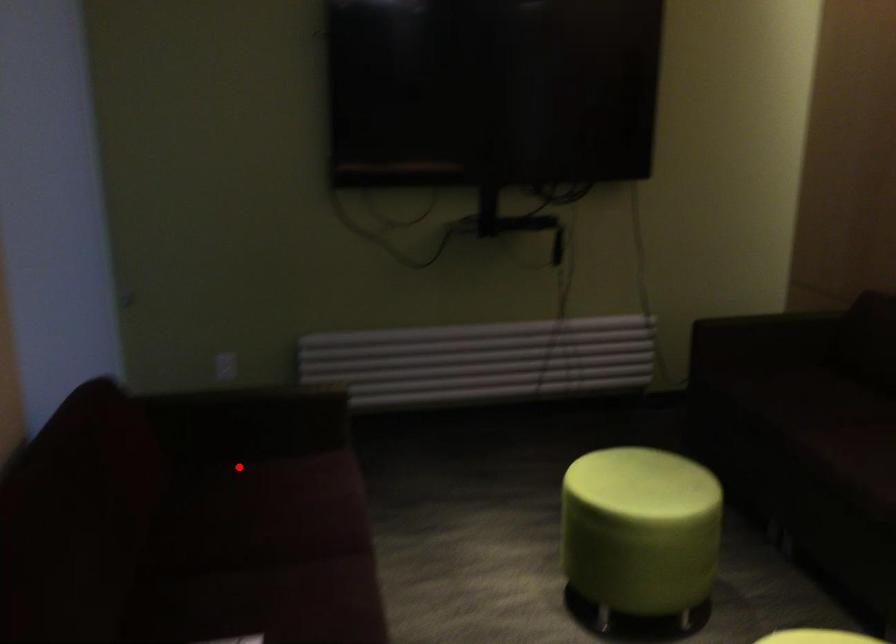
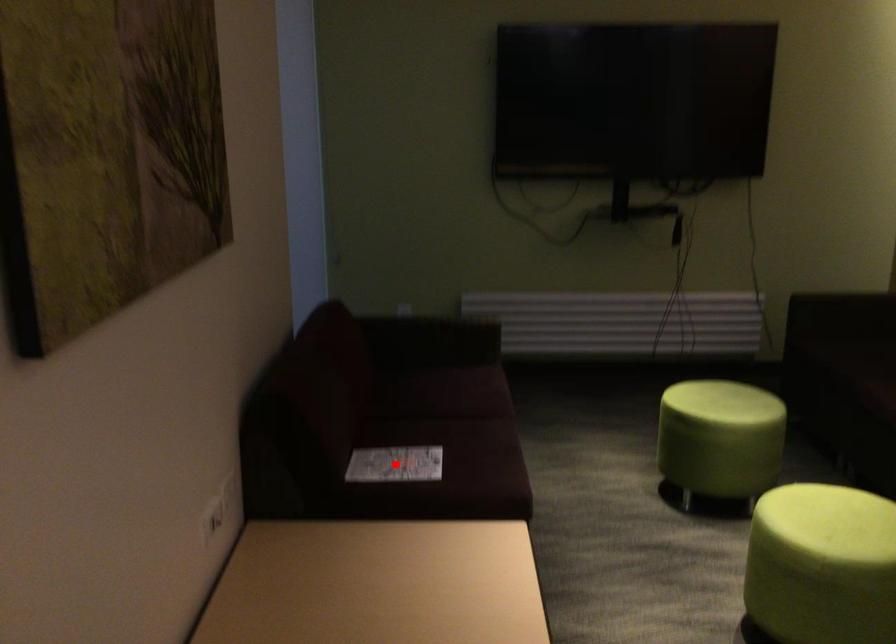
I am providing you with two images of the same scene from different viewpoints. A red point is marked on the first image and another point is marked on the second image. Does the point marked in image1 correspond to the same location as the one in image2?

No